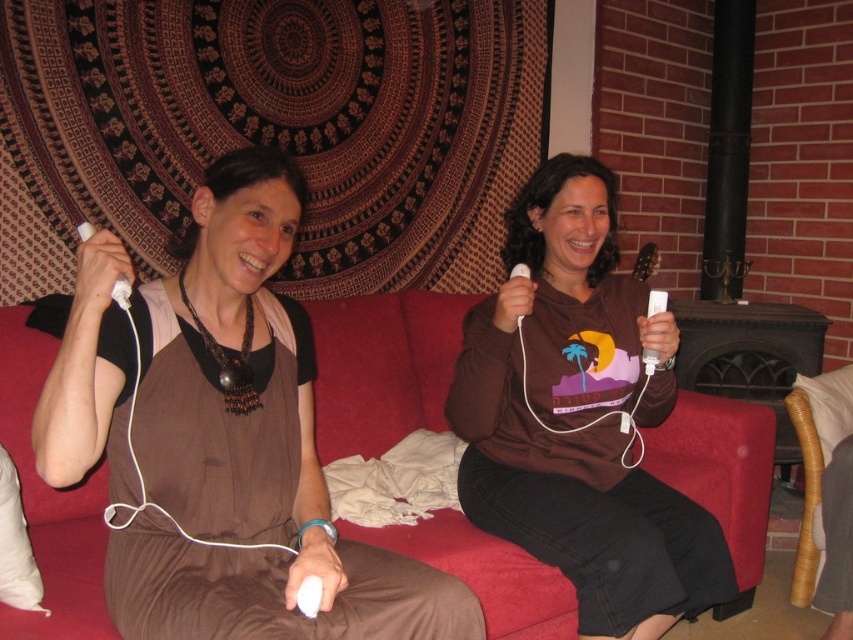
Is brown fabric dress at center smaller than white matte remote at left?

No.

Is brown fabric dress at center below white matte remote at left?

Correct, brown fabric dress at center is located below white matte remote at left.

This screenshot has height=640, width=853. What do you see at coordinates (256, 336) in the screenshot?
I see `brown fabric dress at center` at bounding box center [256, 336].

Identify the location of brown fabric dress at center. Image resolution: width=853 pixels, height=640 pixels. (256, 336).

Is brown fabric dress at center to the right of white plastic remote at upper center from the viewer's perspective?

Indeed, brown fabric dress at center is positioned on the right side of white plastic remote at upper center.

Can you confirm if brown fabric dress at center is shorter than white plastic remote at upper center?

Incorrect, brown fabric dress at center's height does not fall short of white plastic remote at upper center's.

Does point (496, 488) come behind point (527, 268)?

Yes, point (496, 488) is behind point (527, 268).

Identify the location of brown fabric dress at center. (256, 336).

Which is more to the left, white plastic remote at center or white plastic remote at upper center?

From the viewer's perspective, white plastic remote at upper center appears more on the left side.

Does point (647, 352) come in front of point (521, 273)?

That is False.

Is point (643, 362) positioned in front of point (514, 273)?

No, (643, 362) is further to viewer.

Find the location of a particular element. white plastic remote at center is located at coordinates (656, 301).